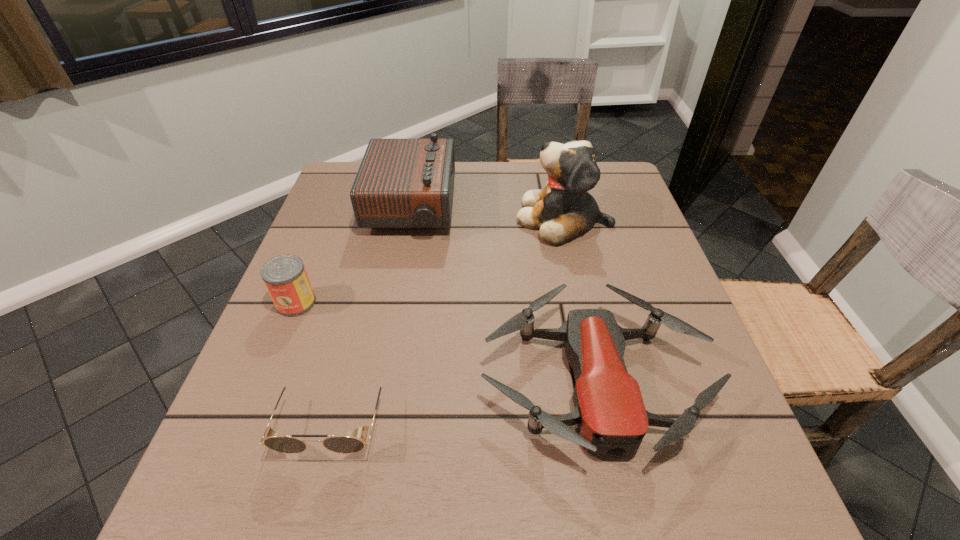
At what (x,y) coordinates should I click in order to perform the action: click on object that is positioned at the far right corner. Please return your answer as a coordinate pair (x, y). The height and width of the screenshot is (540, 960). Looking at the image, I should click on (564, 209).

Locate an element on the screen. object situated at the near right corner is located at coordinates (611, 417).

Where is `vacant space at the far edge of the desktop`? This screenshot has width=960, height=540. vacant space at the far edge of the desktop is located at coordinates (498, 180).

Where is `free space at the near edge of the desktop`? free space at the near edge of the desktop is located at coordinates (514, 483).

The image size is (960, 540). What are the coordinates of `free space at the left edge of the desktop` in the screenshot? It's located at (331, 223).

The width and height of the screenshot is (960, 540). Find the location of `vacant area at the right edge`. vacant area at the right edge is located at coordinates (706, 441).

The image size is (960, 540). In the image, there is a desktop. What are the coordinates of `vacant space at the near right corner` in the screenshot? It's located at (684, 479).

This screenshot has height=540, width=960. Identify the location of vacant area that lies between the drone and the leftmost object. (445, 341).

I want to click on free space between the radio receiver and the drone, so click(x=503, y=294).

Find the location of `free space that is in between the sunglasses and the drone`. free space that is in between the sunglasses and the drone is located at coordinates (464, 400).